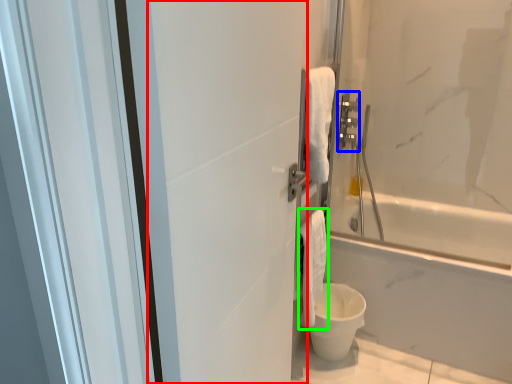
Question: Estimate the real-world distances between objects in this image. Which object is farther from screen door (highlighted by a red box), towel bar (highlighted by a blue box) or bath towel (highlighted by a green box)?

Choices:
 (A) towel bar
 (B) bath towel

Answer: (A)